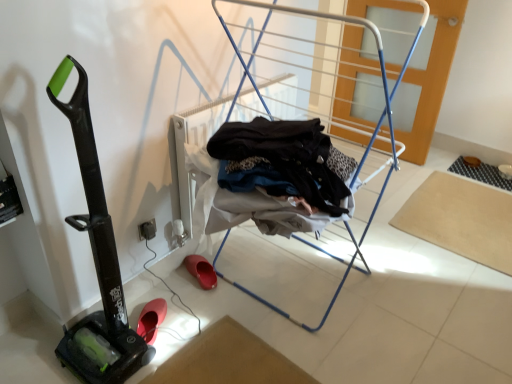
You are a GUI agent. You are given a task and a screenshot of the screen. Output one action in this format:
    pyautogui.click(x=<x>, y=<y>)
    Task: Click on the free space to the left of beige fabric yoga mat at lower right
    The height and width of the screenshot is (384, 512).
    Given the screenshot: What is the action you would take?
    pyautogui.click(x=380, y=230)